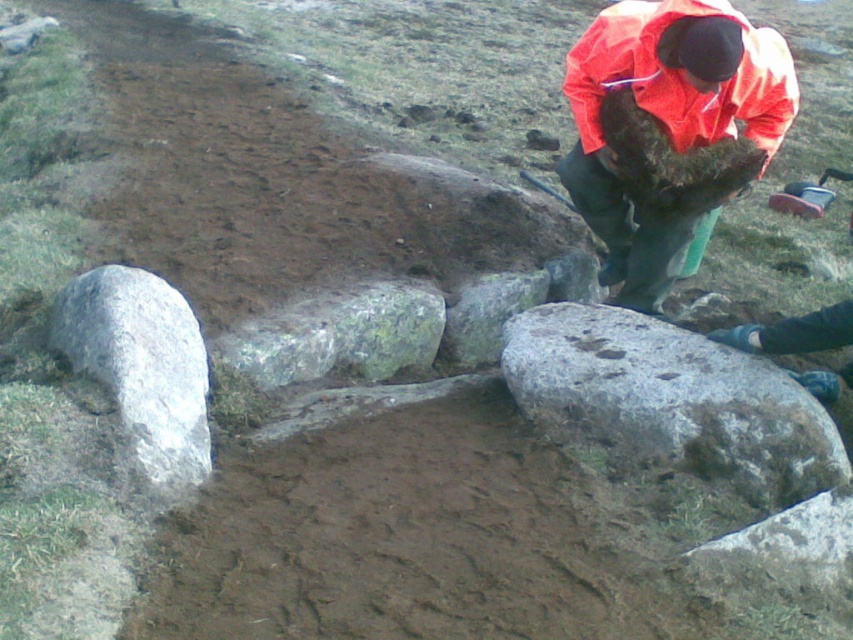
You are a photographer standing at the camera position. You want to take a closeup shot of the orange waterproof jacket at upper right without moving the jacket. Can you get a clear closeup shot if your camera has a maximum zoom of 10x? Assume the minimum focusing distance of your camera is 1 foot.

The orange waterproof jacket at upper right is 9.77 feet away from the camera. Since the minimum focusing distance is 1 foot, the camera can focus on the jacket at 9.77 feet. A 10x zoom lens can capture clear details from that distance, so yes, you can get a clear closeup shot.

Based on the scene description, can you determine if the gray rough stone at center is wider than the gray rough rock at lower left?

The gray rough stone at center might be wider than gray rough rock at lower left according to the description.

You are an archaeologist at the excavation site. You need to reach the gray rough stone at center to examine it, but you must first ensure that your orange waterproof jacket at upper right won

The gray rough stone at center and orange waterproof jacket at upper right are 26.41 inches apart from each other. Since the distance is less than an average person